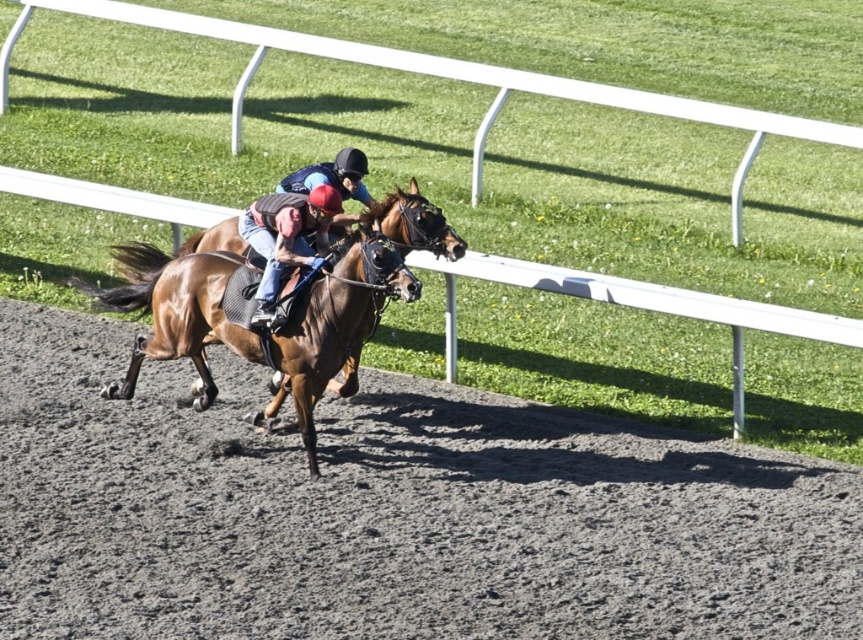
What is the purpose of the white plastic rail at center marked by point (x=444, y=76)?

The white plastic rail at center marked by point (x=444, y=76) is used to define the boundary of the racing track, ensuring that the horses stay within the designated path during the race.

You are a spectator standing at the edge of the horse racing track. You see the white plastic rail at center and the brown glossy horse at center. Which object is closer to your right side?

The brown glossy horse at center is to the right of the white plastic rail at center, so the brown glossy horse at center is closer to your right side.

You are a photographer positioned at the edge of the track, and you want to take a photo of the leather helmet at center without the brown dirt track at center blocking the view. Is this possible based on their positions?

The brown dirt track at center is closer to the viewer than the leather helmet at center, so the dirt track would block the view of the helmet. Therefore, it is not possible to take a photo of the leather helmet at center without the dirt track blocking it.